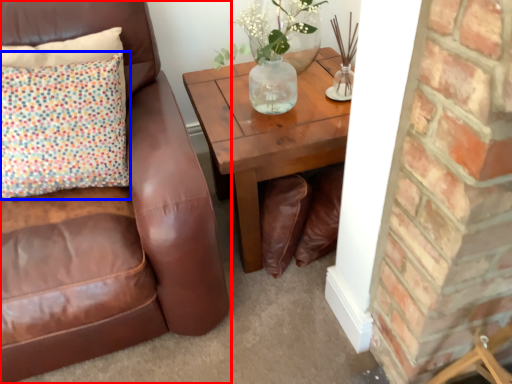
Question: Which object appears farthest to the camera in this image, chair (highlighted by a red box) or pillow (highlighted by a blue box)?

Choices:
 (A) chair
 (B) pillow

Answer: (B)